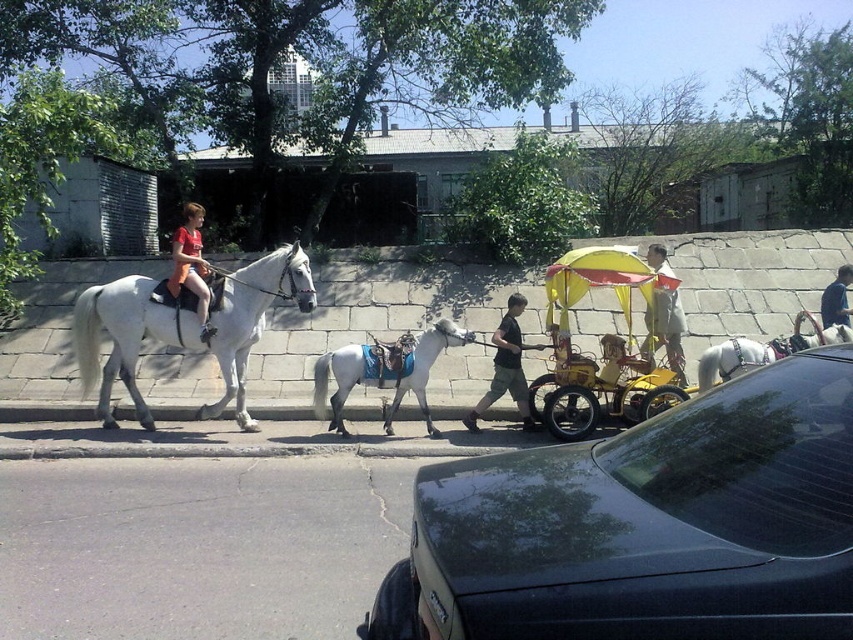
Question: Considering the relative positions of black cotton shirt at center and dark blue shirt at center in the image provided, where is black cotton shirt at center located with respect to dark blue shirt at center?

Choices:
 (A) right
 (B) left

Answer: (B)

Question: Where is light gray glossy horse at center located in relation to white glossy horse at center in the image?

Choices:
 (A) below
 (B) above

Answer: (A)

Question: Among these points, which one is farthest from the camera?

Choices:
 (A) (804, 340)
 (B) (651, 339)
 (C) (202, 337)

Answer: (B)

Question: Which object appears farthest from the camera in this image?

Choices:
 (A) white glossy horse at center
 (B) light brown fabric umbrella at center
 (C) light gray glossy horse at center
 (D) shiny black car at center

Answer: (B)

Question: Which of the following is the closest to the observer?

Choices:
 (A) (374, 339)
 (B) (94, 339)
 (C) (190, 243)

Answer: (B)

Question: Does shiny black car at center have a lesser width compared to white glossy horse at center?

Choices:
 (A) yes
 (B) no

Answer: (A)